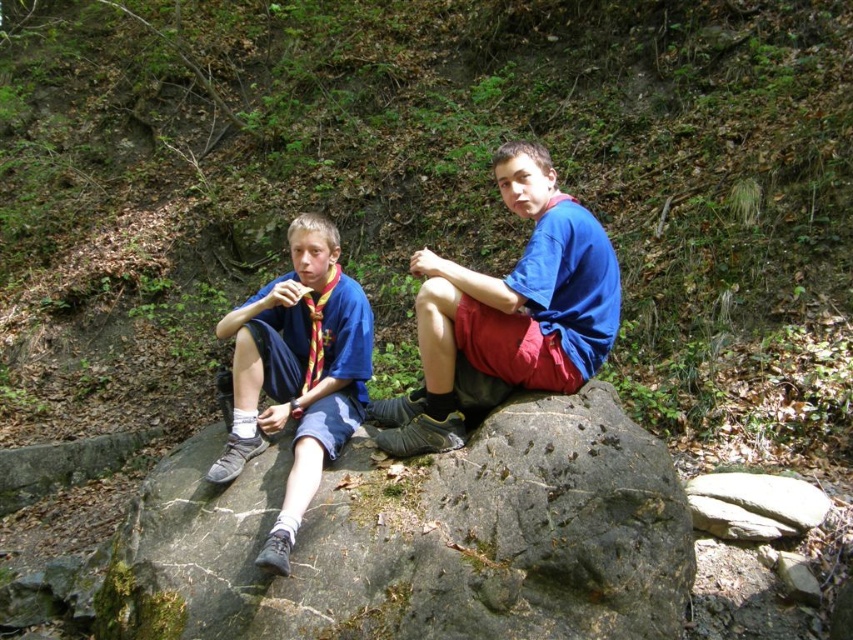
Is point (500, 554) closer to camera compared to point (296, 371)?

Yes, it is in front of point (296, 371).

Identify the location of gray rough rock at center. (419, 538).

Is point (656, 470) positioned after point (326, 262)?

No.

You are a GUI agent. You are given a task and a screenshot of the screen. Output one action in this format:
    pyautogui.click(x=<x>, y=<y>)
    Task: Click on the gray rough rock at center
    The width and height of the screenshot is (853, 640).
    Given the screenshot: What is the action you would take?
    pyautogui.click(x=419, y=538)

Based on the photo, who is more forward, [556,452] or [450,292]?

Point [556,452]

Does gray rough rock at center lie behind blue fabric shorts at center?

No, it is in front of blue fabric shorts at center.

Which is in front, point (444, 564) or point (573, 292)?

Point (444, 564)

Locate an element on the screen. This screenshot has width=853, height=640. gray rough rock at center is located at coordinates (419, 538).

Is blue fabric shorts at center shorter than matte blue shorts at left?

Indeed, blue fabric shorts at center has a lesser height compared to matte blue shorts at left.

Is blue fabric shorts at center further to the viewer compared to matte blue shorts at left?

Yes, it is behind matte blue shorts at left.

This screenshot has height=640, width=853. In order to click on blue fabric shorts at center in this screenshot , I will do `click(509, 310)`.